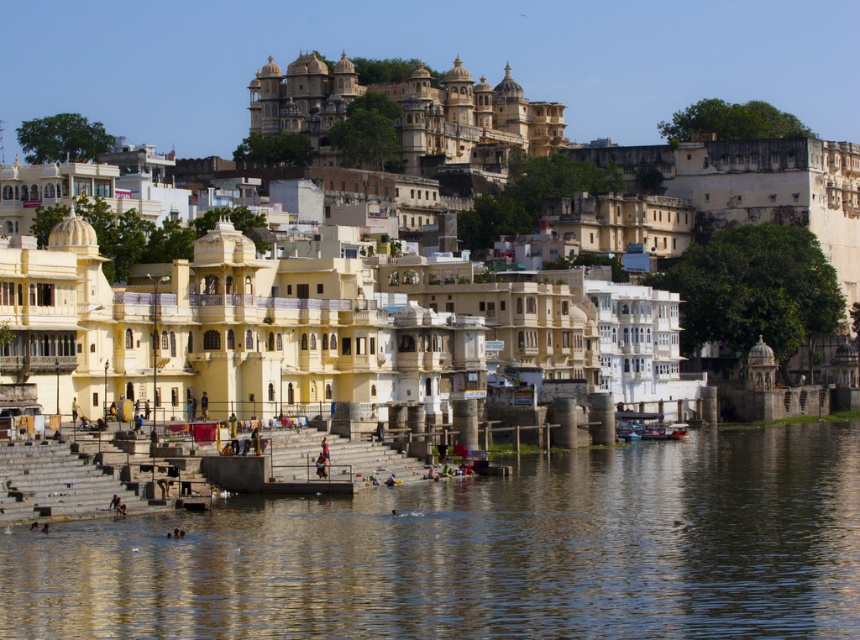
Describe the element at coordinates (483, 552) in the screenshot. I see `brown water at lower center` at that location.

Does brown water at lower center appear on the left side of matte yellow building at center?

In fact, brown water at lower center is to the right of matte yellow building at center.

Measure the distance between point (114,563) and camera.

Point (114,563) is 69.93 meters away from camera.

Find the location of `brown water at lower center`. brown water at lower center is located at coordinates (483, 552).